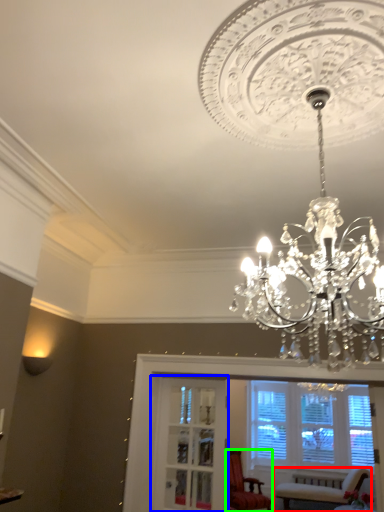
Question: Based on their relative distances, which object is farther from chair (highlighted by a red box)? Choose from glass door (highlighted by a blue box) and chair (highlighted by a green box).

Choices:
 (A) glass door
 (B) chair

Answer: (A)